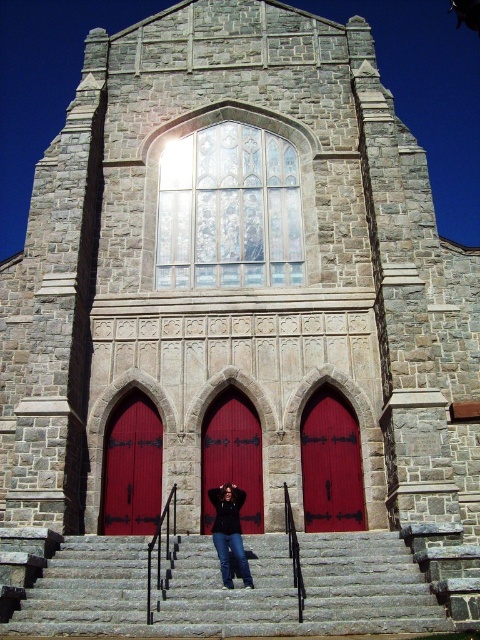
Is gray stone stairs at center to the right of denim pants at center from the viewer's perspective?

Correct, you'll find gray stone stairs at center to the right of denim pants at center.

Does gray stone stairs at center appear under denim pants at center?

Correct, gray stone stairs at center is located below denim pants at center.

Is point (214, 604) closer to camera compared to point (237, 520)?

Yes, it is in front of point (237, 520).

Locate an element on the screen. gray stone stairs at center is located at coordinates (231, 589).

Does gray stone stairs at center appear under smooth glossy wood door at center?

Indeed, gray stone stairs at center is positioned under smooth glossy wood door at center.

Does gray stone stairs at center appear on the right side of smooth glossy wood door at center?

Yes, gray stone stairs at center is to the right of smooth glossy wood door at center.

Describe the element at coordinates (231, 589) in the screenshot. This screenshot has height=640, width=480. I see `gray stone stairs at center` at that location.

Where is `gray stone stairs at center`? gray stone stairs at center is located at coordinates (231, 589).

Who is higher up, smooth glossy red door at center or denim pants at center?

smooth glossy red door at center

Between point (347, 419) and point (223, 490), which one is positioned behind?

Positioned behind is point (347, 419).

Is point (313, 454) positioned before point (236, 518)?

That is False.

Locate an element on the screen. Image resolution: width=480 pixels, height=640 pixels. smooth glossy red door at center is located at coordinates (331, 465).